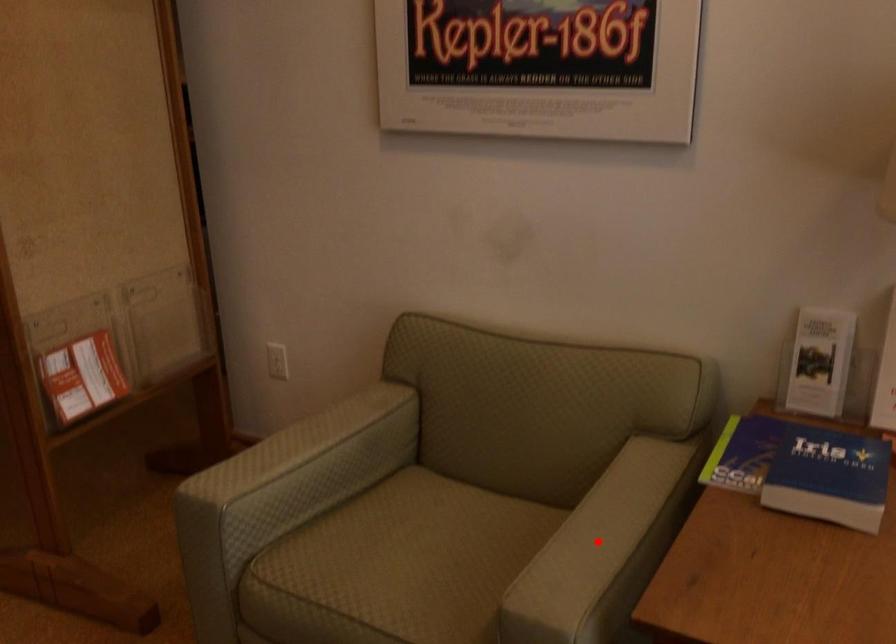
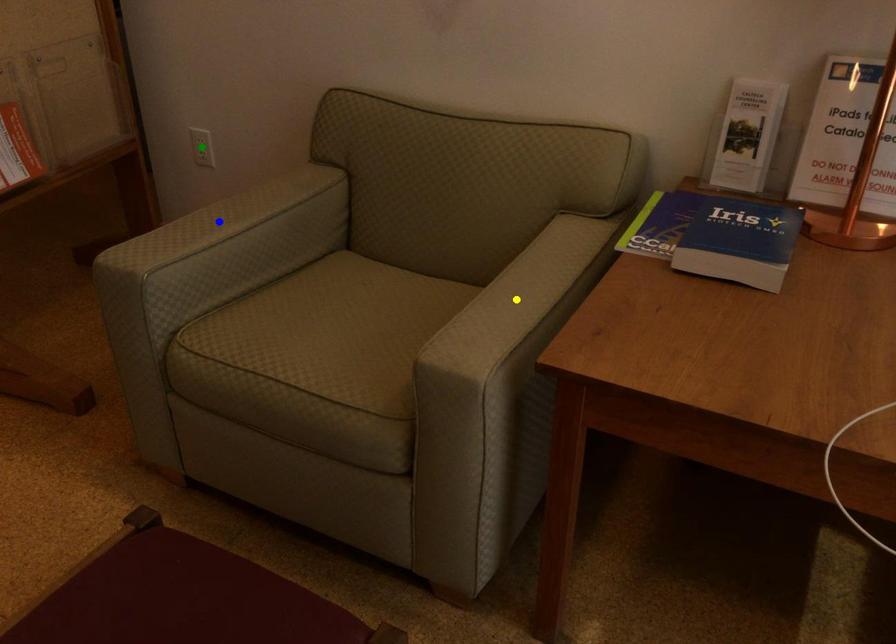
Question: I am providing you with two images of the same scene from different viewpoints. A red point is marked on the first image. You are given multiple points on the second image. Which point in image 2 represents the same 3d spot as the red point in image 1?

Choices:
 (A) green point
 (B) yellow point
 (C) blue point

Answer: (B)